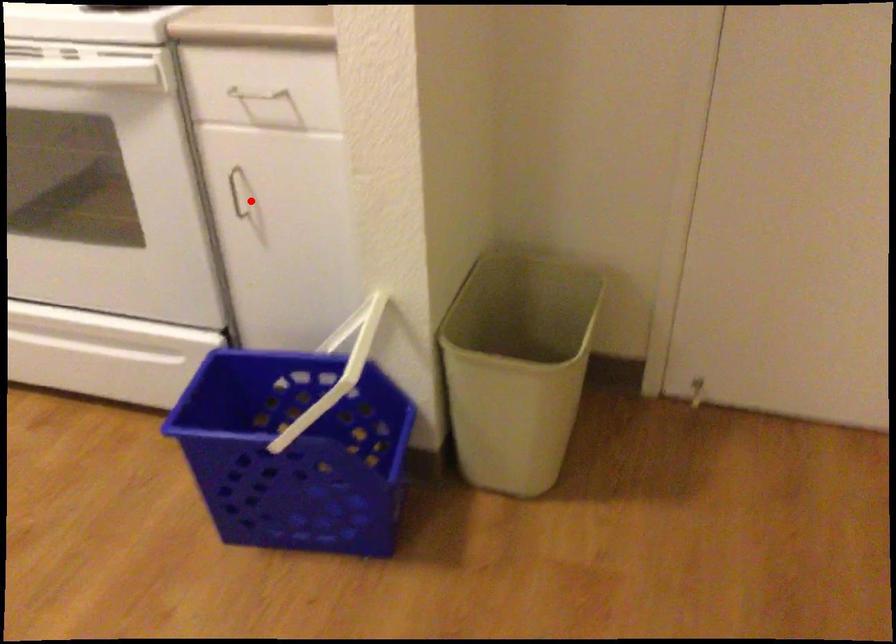
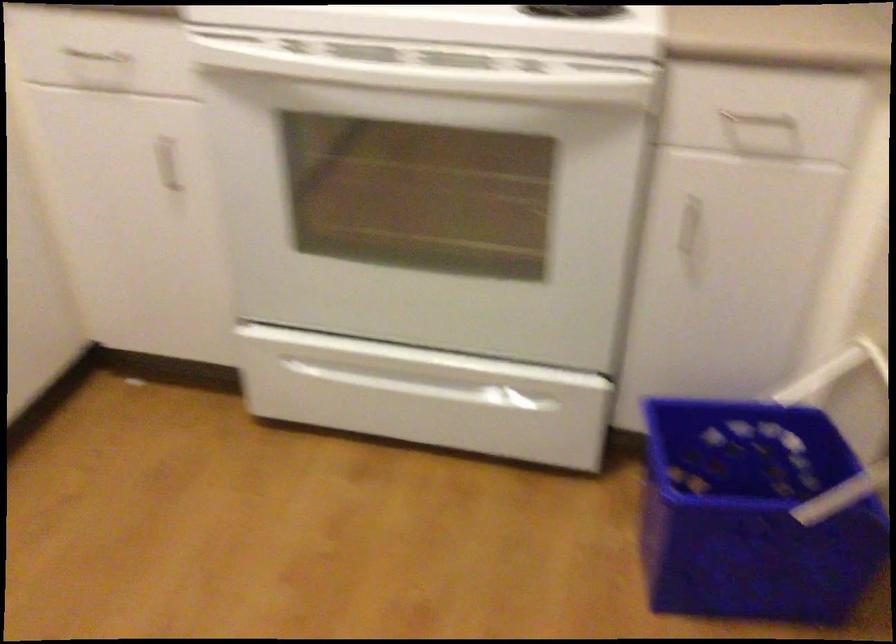
Where in the second image is the point corresponding to the highlighted location from the first image?

(691, 228)